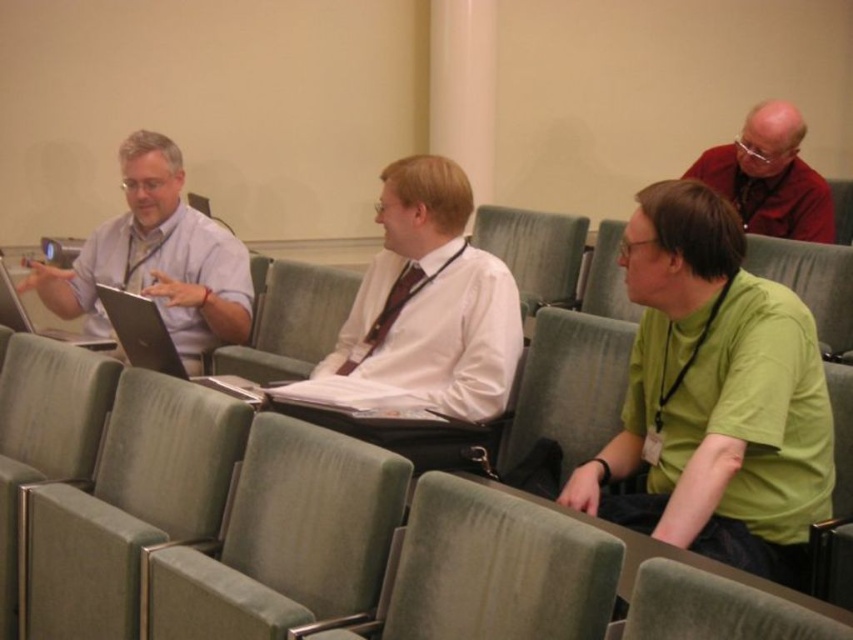
You are standing at the origin point in the image coordinate system. Which direction should you move to reach the green fabric chair at lower left?

The green fabric chair at lower left is located at coordinates point (129, 506), so you should move towards the lower left direction to reach it.

Based on the scene, is the green fabric chair at lower left positioned lower than the white satin shirt at center?

Yes, the green fabric chair at lower left is positioned below the white satin shirt at center, so it is lower.

You are standing in the conference room and need to pass a document to the person wearing the matte red shirt at upper right. If you are currently 4 meters away from them, can you reach them without moving closer?

The matte red shirt at upper right and viewer are 3.22 meters apart from each other. Since you are currently 4 meters away, you are farther than the required distance. Therefore, you cannot reach them without moving closer.